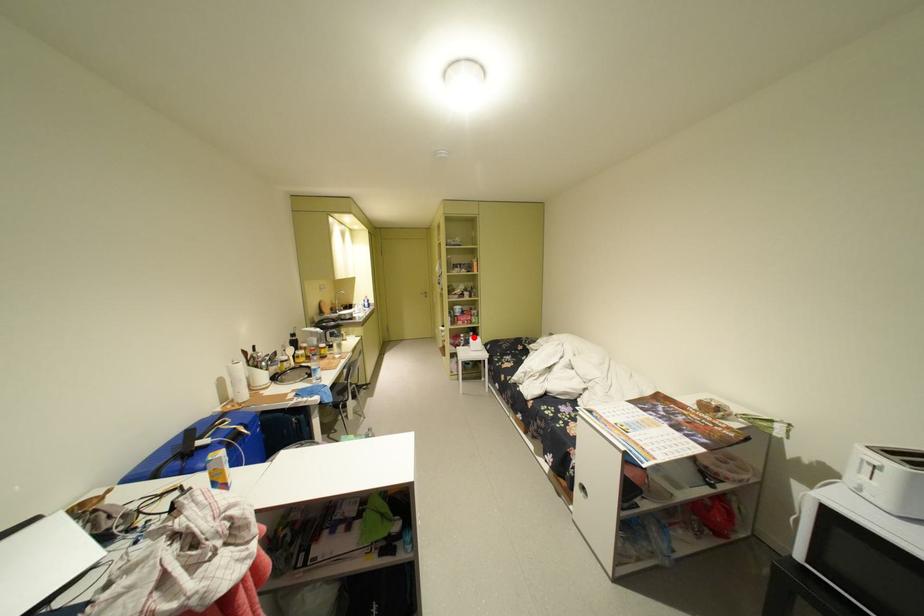
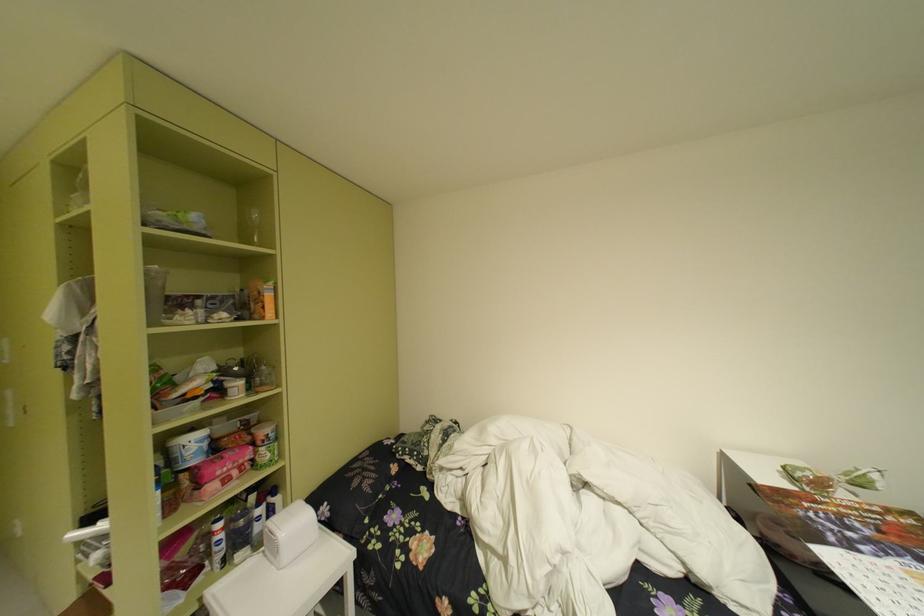
Question: I am providing you with two images of the same scene from different viewpoints. A red point is shown in image1. For the corresponding object point in image2, is it positioned nearer or farther from the camera?

Choices:
 (A) Nearer
 (B) Farther

Answer: (A)